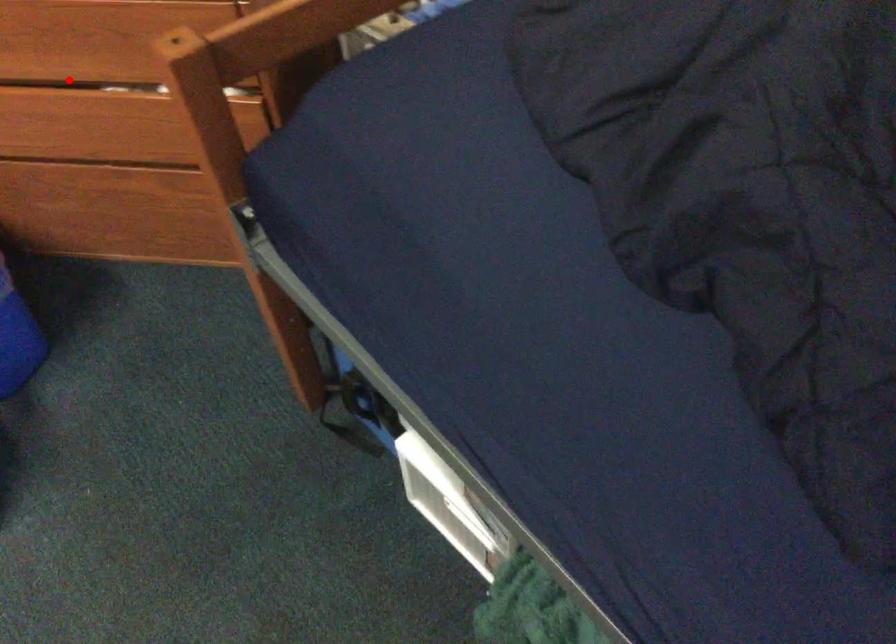
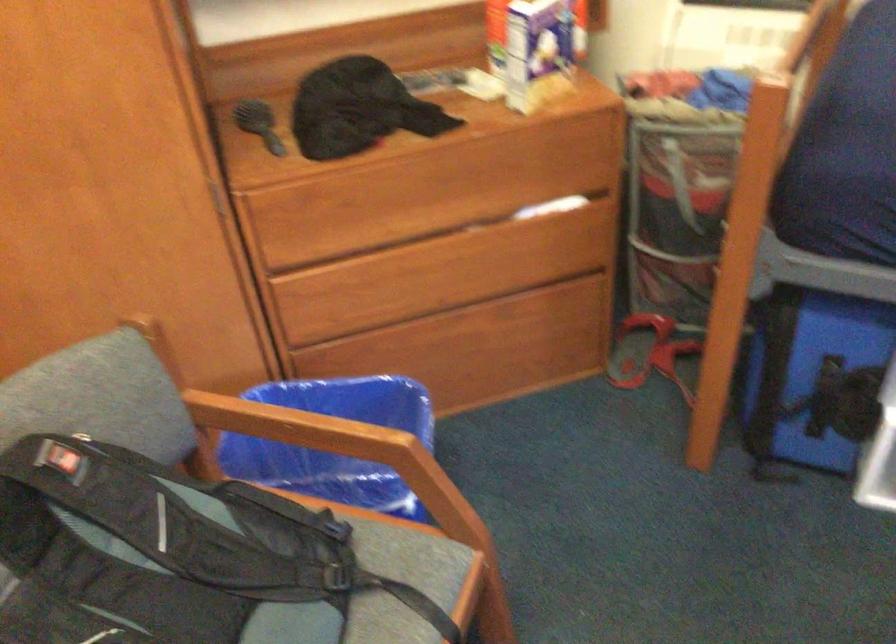
Locate, in the second image, the point that corresponds to the highlighted location in the first image.

(420, 238)